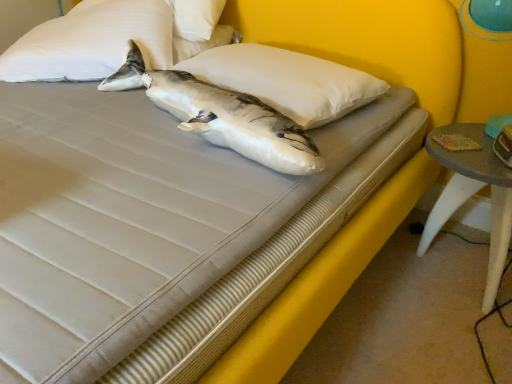
The image size is (512, 384). Find the location of `space that is in front of smooth gray table at lower right`. space that is in front of smooth gray table at lower right is located at coordinates (447, 339).